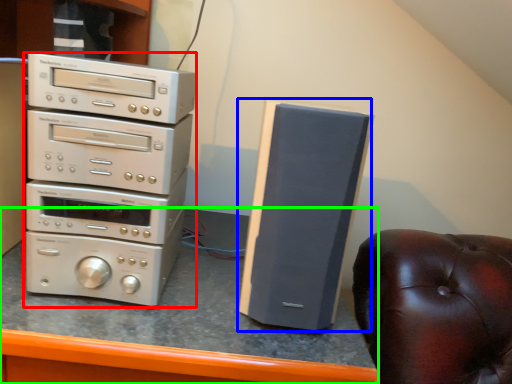
Question: Which is nearer to the home appliance (highlighted by a red box)? speaker (highlighted by a blue box) or computer desk (highlighted by a green box).

Choices:
 (A) speaker
 (B) computer desk

Answer: (B)